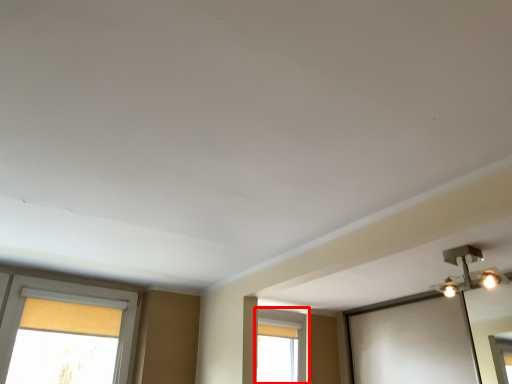
Question: Where is window (annotated by the red box) located in relation to light fixture in the image?

Choices:
 (A) left
 (B) right

Answer: (A)